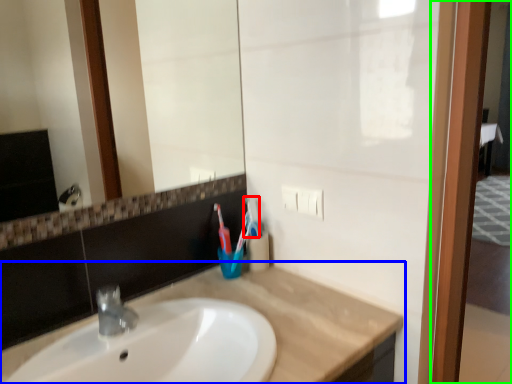
Question: Which object is positioned closest to toothbrush (highlighted by a red box)? Select from countertop (highlighted by a blue box) and screen door (highlighted by a green box).

Choices:
 (A) countertop
 (B) screen door

Answer: (A)